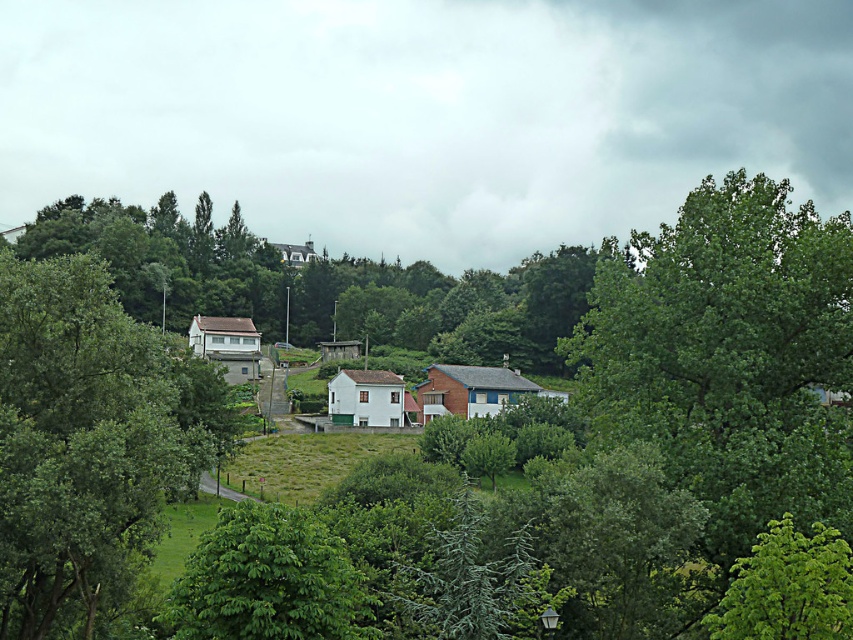
Question: Which object is farther from the camera taking this photo?

Choices:
 (A) green leafy tree at lower center
 (B) green leafy tree at right
 (C) green leafy tree at left

Answer: (B)

Question: Which object appears closest to the camera in this image?

Choices:
 (A) green leafy tree at right
 (B) green leafy tree at lower center
 (C) green leafy tree at left
 (D) green leafy tree at center

Answer: (B)

Question: Does green leafy tree at lower center have a smaller size compared to green leafy tree at lower right?

Choices:
 (A) no
 (B) yes

Answer: (A)

Question: Considering the real-world distances, which object is closest to the green leafy tree at right?

Choices:
 (A) green leafy tree at center
 (B) green leafy tree at left

Answer: (B)

Question: Can you confirm if green leafy tree at left is positioned to the right of green leafy tree at lower center?

Choices:
 (A) yes
 (B) no

Answer: (B)

Question: Does green leafy tree at left lie behind green leafy tree at center?

Choices:
 (A) yes
 (B) no

Answer: (B)